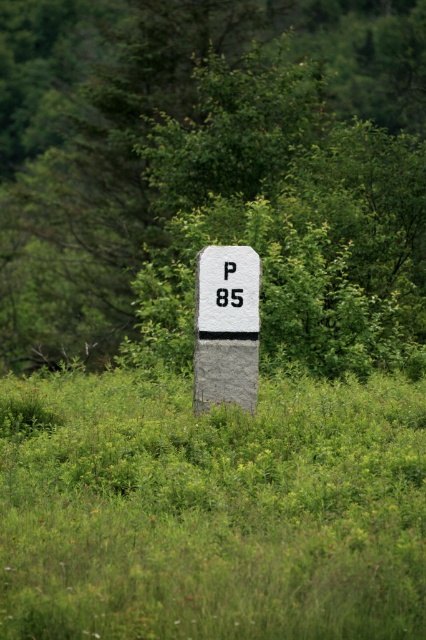
Does point (299, 97) lie in front of point (20, 588)?

No, (299, 97) is further to viewer.

Which of these two, green leafy tree at center or green grassy at center, stands shorter?

With less height is green grassy at center.

Is point (17, 342) positioned before point (204, 436)?

No, (17, 342) is behind (204, 436).

Locate an element on the screen. The image size is (426, 640). green leafy tree at center is located at coordinates (230, 186).

Is point (241, 445) positioned before point (224, 294)?

That is True.

Is green grassy at center thinner than black plastic number at center?

Incorrect, green grassy at center's width is not less than black plastic number at center's.

Does point (227, 476) come in front of point (232, 262)?

Yes, it is.

Image resolution: width=426 pixels, height=640 pixels. What are the coordinates of `green grassy at center` in the screenshot? It's located at (212, 512).

From the picture: Can you confirm if green leafy tree at center is thinner than gray stone sign at center?

Incorrect, green leafy tree at center's width is not less than gray stone sign at center's.

Does point (420, 257) lie behind point (227, 321)?

Yes, it is behind point (227, 321).

Where is `green leafy tree at center`? This screenshot has height=640, width=426. green leafy tree at center is located at coordinates (230, 186).